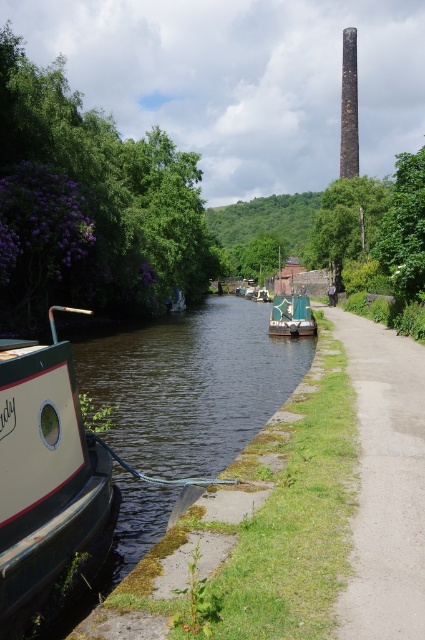
Question: Can you confirm if purple leafy tree at upper left is bigger than green canvas boat at center?

Choices:
 (A) no
 (B) yes

Answer: (B)

Question: Which point is farther to the camera?

Choices:
 (A) rusty brick chimney at upper center
 (B) purple leafy tree at upper left
 (C) green grass at lower left

Answer: (A)

Question: Which point is closer to the camera?

Choices:
 (A) (261, 280)
 (B) (294, 298)
 (C) (17, 115)
 (D) (399, 369)

Answer: (D)

Question: Considering the relative positions of purple leafy tree at upper left and rusty brick chimney at upper center in the image provided, where is purple leafy tree at upper left located with respect to rusty brick chimney at upper center?

Choices:
 (A) above
 (B) below

Answer: (B)

Question: Estimate the real-world distances between objects in this image. Which object is farther from the white glossy boat at left?

Choices:
 (A) green grass at lower left
 (B) green leafy tree at upper right

Answer: (B)

Question: Can you confirm if purple leafy tree at upper left is positioned to the right of rusty brick chimney at upper center?

Choices:
 (A) no
 (B) yes

Answer: (A)